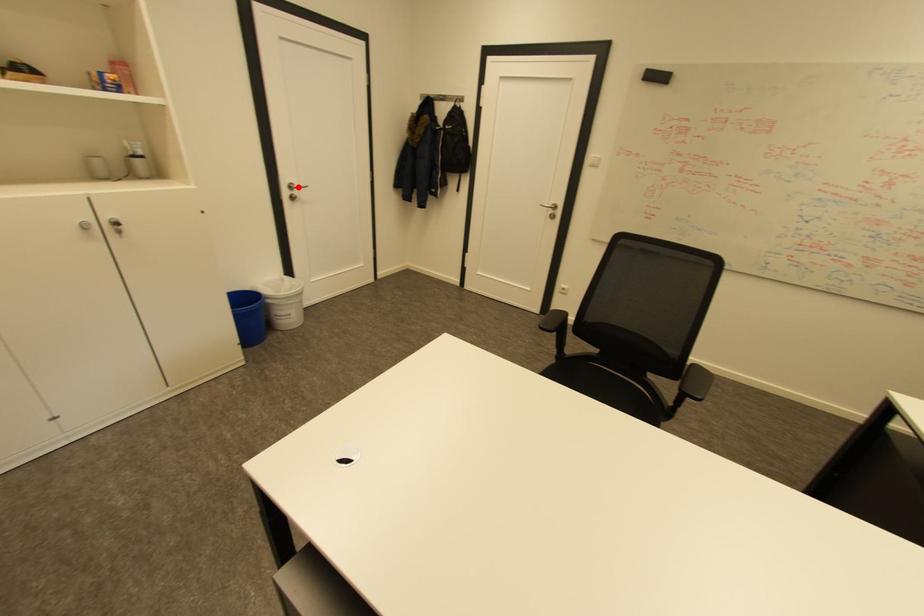
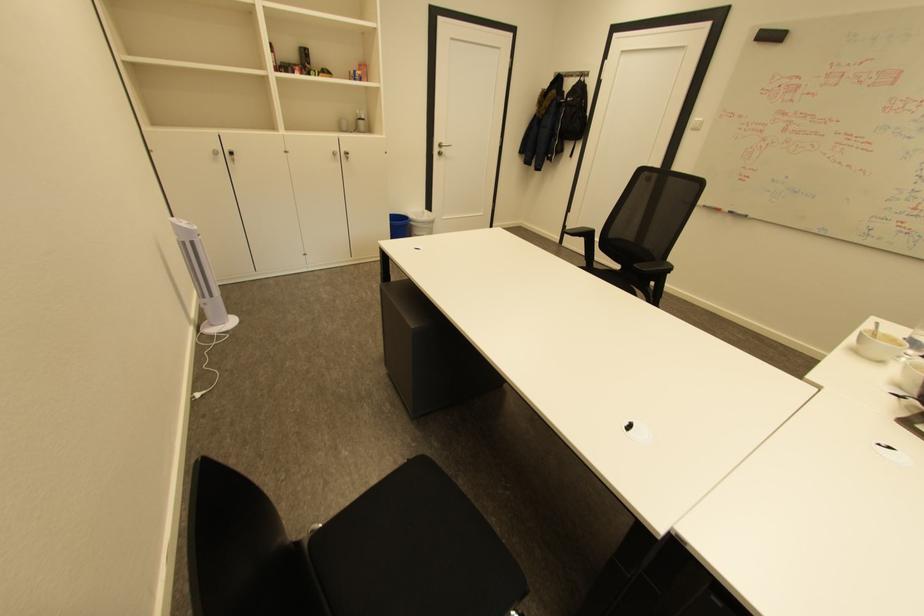
Question: I am providing you with two images of the same scene from different viewpoints. A red point is shown in image1. For the corresponding object point in image2, is it positioned nearer or farther from the camera?

Choices:
 (A) Nearer
 (B) Farther

Answer: (A)